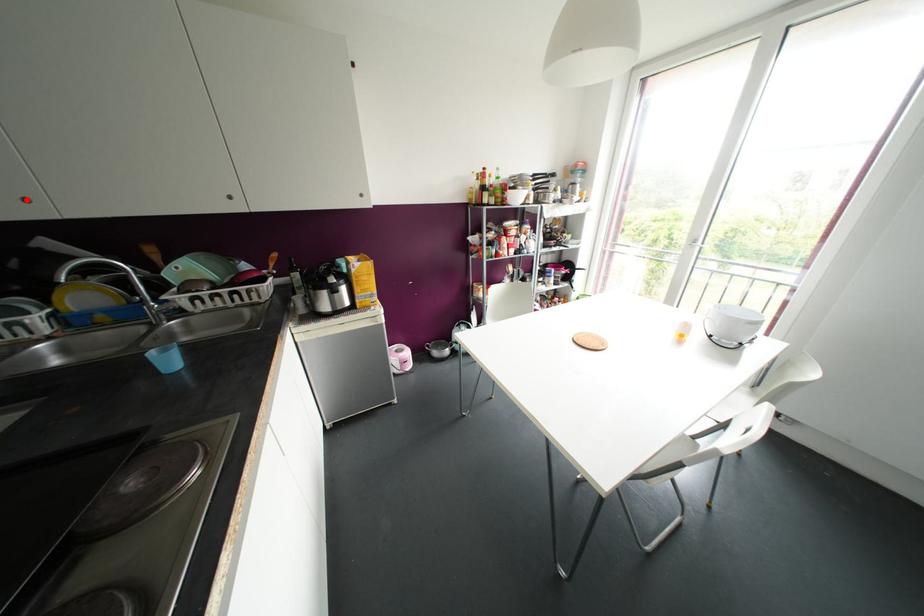
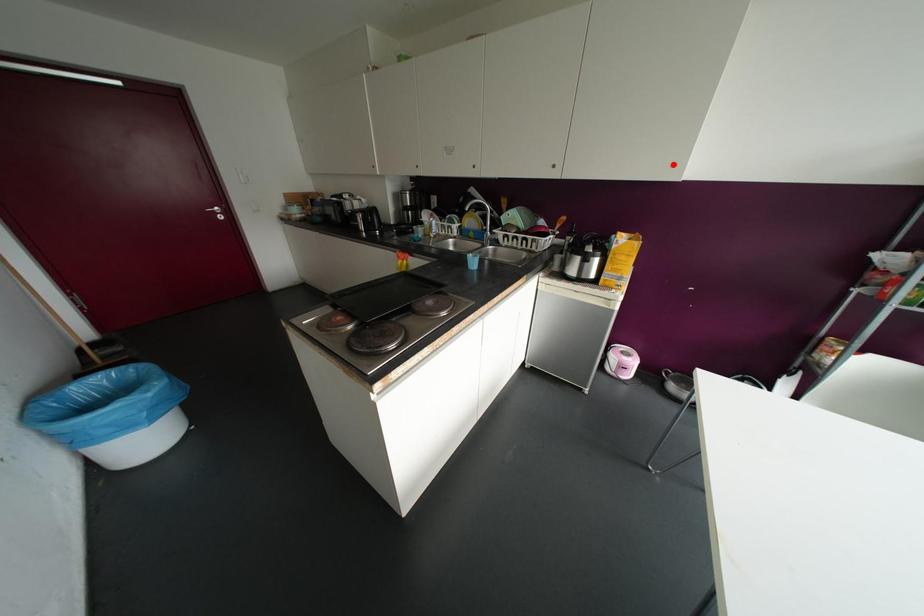
I am providing you with two images of the same scene from different viewpoints. A red point is marked on the first image and another point is marked on the second image. Is the marked point in image1 the same physical position as the marked point in image2?

No